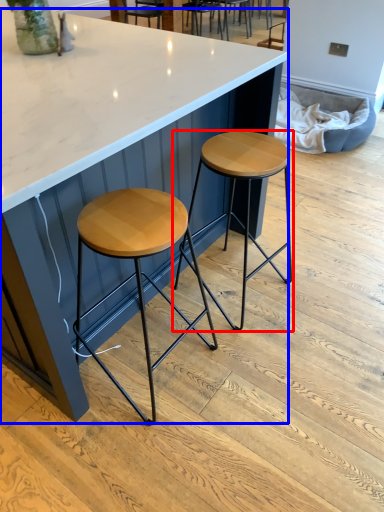
Question: Which object appears closest to the camera in this image, stool (highlighted by a red box) or table (highlighted by a blue box)?

Choices:
 (A) stool
 (B) table

Answer: (B)